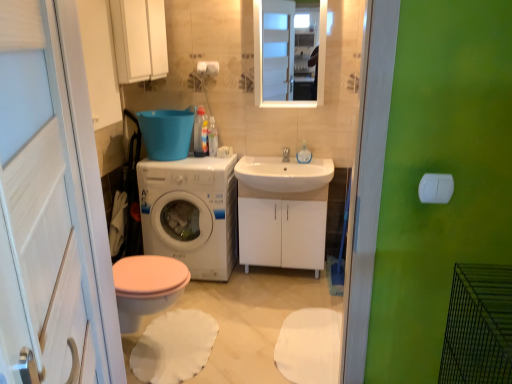
Where is `free space in front of white glossy cabinet at center`? free space in front of white glossy cabinet at center is located at coordinates (282, 302).